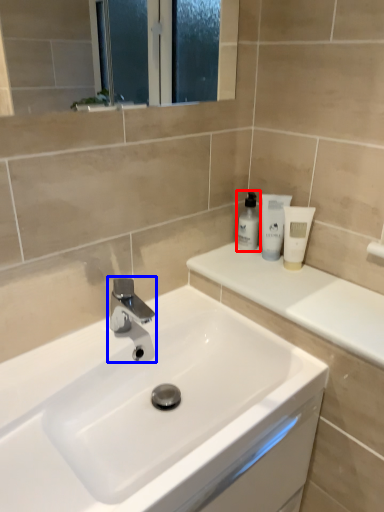
Question: Which of the following is the farthest to the observer, toiletry (highlighted by a red box) or tap (highlighted by a blue box)?

Choices:
 (A) toiletry
 (B) tap

Answer: (A)